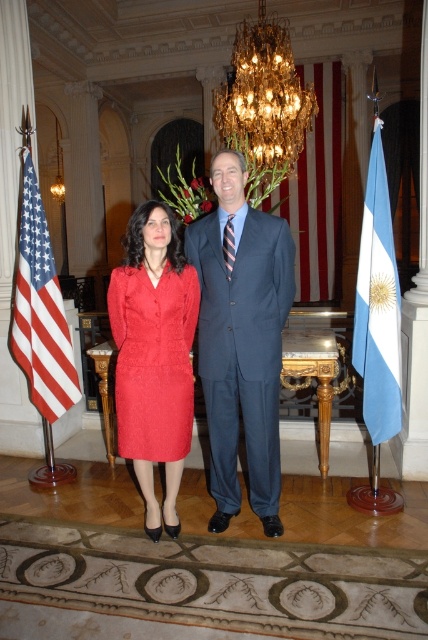
Which is below, gold crystal chandelier at upper center or red/white striped flag at center?

gold crystal chandelier at upper center is below.

Which is behind, point (270, 22) or point (296, 204)?

Positioned behind is point (296, 204).

I want to click on gold crystal chandelier at upper center, so click(264, 99).

Is dark blue suit at center shorter than red/white striped flag at center?

Yes.

Can you confirm if dark blue suit at center is taller than red/white striped flag at center?

Incorrect, dark blue suit at center's height is not larger of red/white striped flag at center's.

Is point (267, 336) positioned before point (309, 81)?

Yes, it is.

This screenshot has height=640, width=428. I want to click on dark blue suit at center, so pyautogui.click(x=241, y=339).

Between gold crystal chandelier at upper center and white striped fabric flag at left, which one is positioned higher?

gold crystal chandelier at upper center is above.

This screenshot has width=428, height=640. What do you see at coordinates (264, 99) in the screenshot?
I see `gold crystal chandelier at upper center` at bounding box center [264, 99].

At what (x,y) coordinates should I click in order to perform the action: click on gold crystal chandelier at upper center. Please return your answer as a coordinate pair (x, y). Looking at the image, I should click on (264, 99).